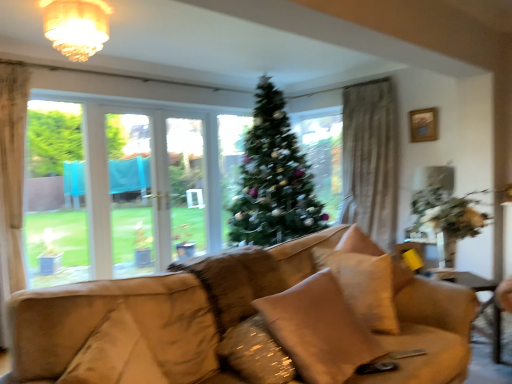
Question: From a real-world perspective, is beige fabric pillow at center, the 2th pillow viewed from the back, on beige fabric pillow at center, which appears as the 1th pillow when viewed from the front?

Choices:
 (A) yes
 (B) no

Answer: (B)

Question: Is beige fabric pillow at center, the second pillow when ordered from front to back, next to beige fabric pillow at center, which appears as the 1th pillow when viewed from the front?

Choices:
 (A) yes
 (B) no

Answer: (B)

Question: Is beige fabric pillow at center, the 2th pillow viewed from the back, bigger than beige fabric pillow at center, the third pillow positioned from the back?

Choices:
 (A) yes
 (B) no

Answer: (B)

Question: Is beige fabric pillow at center, the 2th pillow viewed from the back, outside beige fabric pillow at center, the third pillow positioned from the back?

Choices:
 (A) no
 (B) yes

Answer: (A)

Question: Does beige fabric pillow at center, the 2th pillow viewed from the back, have a greater height compared to beige fabric pillow at center, the third pillow positioned from the back?

Choices:
 (A) no
 (B) yes

Answer: (A)

Question: In terms of width, does beige fabric pillow at center, the 2th pillow viewed from the back, look wider or thinner when compared to suede tan swivel chair at lower left?

Choices:
 (A) wide
 (B) thin

Answer: (A)

Question: In the image, is beige fabric pillow at center, the second pillow when ordered from front to back, on the left side or the right side of suede tan swivel chair at lower left?

Choices:
 (A) left
 (B) right

Answer: (B)

Question: Does point (273, 354) appear closer or farther from the camera than point (202, 342)?

Choices:
 (A) farther
 (B) closer

Answer: (B)

Question: Relative to suede tan swivel chair at lower left, is beige fabric pillow at center, the second pillow when ordered from front to back, in front or behind?

Choices:
 (A) front
 (B) behind

Answer: (B)

Question: Is suede tan swivel chair at lower left to the left or to the right of beige fabric pillow at center, the third pillow positioned from the back, in the image?

Choices:
 (A) right
 (B) left

Answer: (B)

Question: Is point 146,301 positioned closer to the camera than point 321,364?

Choices:
 (A) farther
 (B) closer

Answer: (A)

Question: Is suede tan swivel chair at lower left bigger or smaller than beige fabric pillow at center, which appears as the 1th pillow when viewed from the front?

Choices:
 (A) big
 (B) small

Answer: (B)

Question: Is suede tan swivel chair at lower left situated inside beige fabric pillow at center, the third pillow positioned from the back, or outside?

Choices:
 (A) inside
 (B) outside

Answer: (B)

Question: From the image's perspective, relative to beige fabric pillow at center, the 1th pillow in the back-to-front sequence, is wooden picture frame at upper right above or below?

Choices:
 (A) below
 (B) above

Answer: (B)

Question: Does point (432, 132) appear closer or farther from the camera than point (359, 294)?

Choices:
 (A) closer
 (B) farther

Answer: (B)